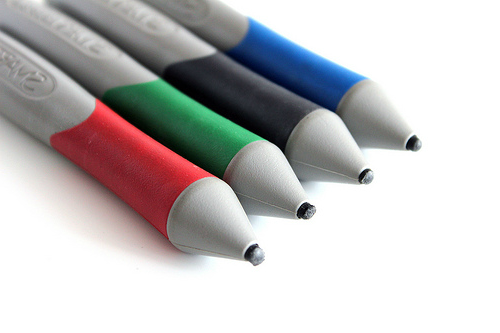
Where is `pens`? The width and height of the screenshot is (500, 333). pens is located at coordinates (156, 176), (205, 148), (255, 103), (296, 75).